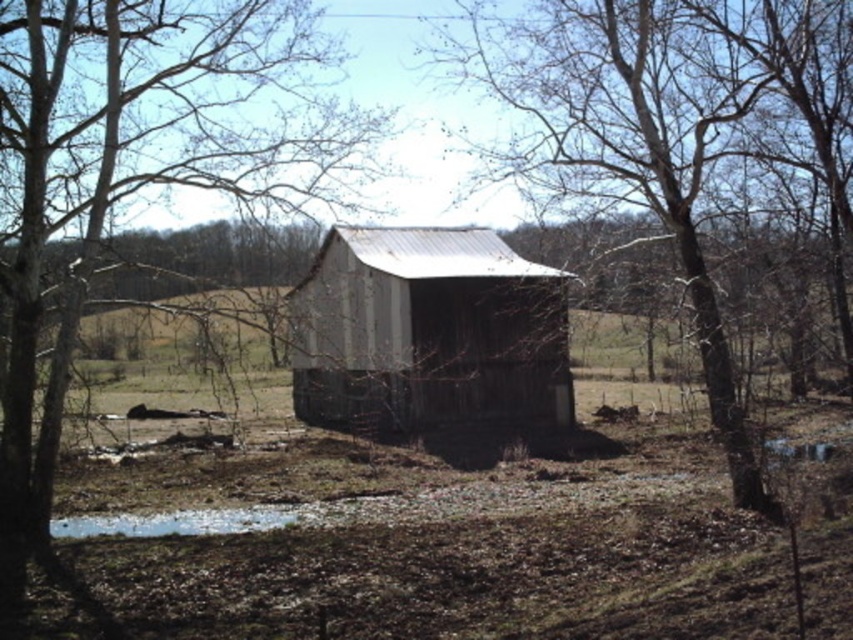
Who is shorter, brown rough wood tree at center or weathered wood barn at center?

weathered wood barn at center is shorter.

Which is more to the left, brown rough wood tree at center or weathered wood barn at center?

Positioned to the left is weathered wood barn at center.

This screenshot has width=853, height=640. In order to click on brown rough wood tree at center in this screenshot , I will do `click(636, 136)`.

Does brown bark tree at left come in front of weathered wood barn at center?

Yes, brown bark tree at left is closer to the viewer.

The height and width of the screenshot is (640, 853). Identify the location of brown bark tree at left. (141, 164).

Identify the location of brown bark tree at left. (141, 164).

Is brown rough wood tree at center taller than white matte puddle at lower center?

Correct, brown rough wood tree at center is much taller as white matte puddle at lower center.

Which of these two, brown rough wood tree at center or white matte puddle at lower center, stands shorter?

white matte puddle at lower center is shorter.

Is point (669, 221) closer to camera compared to point (326, 509)?

That is True.

Image resolution: width=853 pixels, height=640 pixels. Find the location of `brown rough wood tree at center`. brown rough wood tree at center is located at coordinates (636, 136).